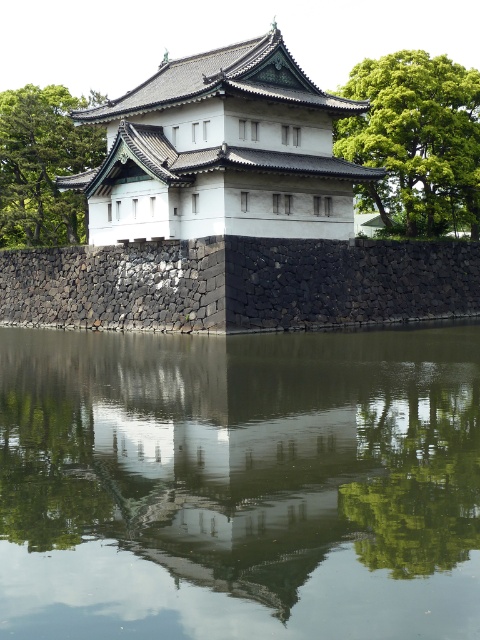
You are standing on the wooden deck of the traditional Japanese building and looking out. You see the green reflective water at center and the green leafy tree at left. Which object is directly above the other?

The green leafy tree at left is directly above the green reflective water at center because the water is positioned under the tree.

You are a tourist standing in front of the traditional Japanese building. You want to take a photo of the green leafy tree at upper right and the green reflective water at center. Which object should you focus on first if you want to include both in your photo without moving the camera?

You should focus on the green leafy tree at upper right first because it is above the green reflective water at center, so adjusting the camera angle to capture both would require framing from the top down.

You are standing in front of the traditional Japanese building and want to take a photo of the black stone wall at lower center and the green reflective water at center. Which object should you frame first in your camera to ensure both are in the shot?

You should frame the black stone wall at lower center first because the green reflective water at center is to the right of it, so positioning the wall first ensures both objects will be included in the photo.